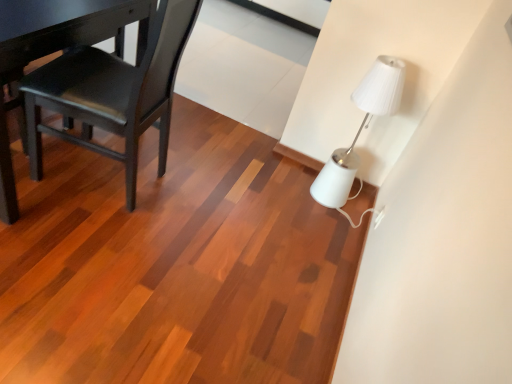
Measure the distance between white plastic electric outlet at lower right and camera.

white plastic electric outlet at lower right and camera are 6.59 feet apart.

The width and height of the screenshot is (512, 384). Describe the element at coordinates (113, 92) in the screenshot. I see `matte black chair at left` at that location.

In order to click on white plastic electric outlet at lower right in this screenshot , I will do `click(379, 216)`.

Considering the sizes of objects white glossy lamp at upper right and white plastic electric outlet at lower right in the image provided, who is wider, white glossy lamp at upper right or white plastic electric outlet at lower right?

white glossy lamp at upper right.

Does white glossy lamp at upper right appear on the left side of white plastic electric outlet at lower right?

Yes.

Who is taller, white glossy lamp at upper right or white plastic electric outlet at lower right?

Standing taller between the two is white glossy lamp at upper right.

What are the coordinates of `electric outlet below the white glossy lamp at upper right (from the image's perspective)` in the screenshot? It's located at (379, 216).

Consider the image. Which object is closer to the camera, white glossy lamp at upper right or matte black chair at left?

matte black chair at left is closer to the camera.

Can we say white glossy lamp at upper right lies outside matte black chair at left?

Yes.

Are white glossy lamp at upper right and matte black chair at left making contact?

No, white glossy lamp at upper right is not next to matte black chair at left.

How distant is white plastic electric outlet at lower right from matte black chair at left?

A distance of 1.30 meters exists between white plastic electric outlet at lower right and matte black chair at left.

Is point (381, 216) closer to viewer compared to point (68, 65)?

No, it is not.

Is white plastic electric outlet at lower right further to camera compared to matte black chair at left?

Yes, white plastic electric outlet at lower right is behind matte black chair at left.

Considering the relative positions of white plastic electric outlet at lower right and matte black chair at left in the image provided, is white plastic electric outlet at lower right to the right of matte black chair at left from the viewer's perspective?

Yes.

From a real-world perspective, is matte black chair at left above or below white glossy lamp at upper right?

Clearly, from a real-world perspective, matte black chair at left is above white glossy lamp at upper right.

Is point (87, 98) closer to viewer compared to point (334, 181)?

Yes, point (87, 98) is in front of point (334, 181).

Is matte black chair at left positioned with its back to white glossy lamp at upper right?

No, matte black chair at left's orientation is not away from white glossy lamp at upper right.

Can you see matte black chair at left touching white glossy lamp at upper right?

No, matte black chair at left is not touching white glossy lamp at upper right.

What are the coordinates of `chair in front of the white plastic electric outlet at lower right` in the screenshot? It's located at (113, 92).

Can you confirm if matte black chair at left is positioned to the left of white plastic electric outlet at lower right?

Yes, matte black chair at left is to the left of white plastic electric outlet at lower right.

Which of these two, matte black chair at left or white plastic electric outlet at lower right, is bigger?

matte black chair at left.

Which object is further away from the camera taking this photo, white plastic electric outlet at lower right or white glossy lamp at upper right?

white plastic electric outlet at lower right is further from the camera.

From the image's perspective, which one is positioned higher, white plastic electric outlet at lower right or white glossy lamp at upper right?

white glossy lamp at upper right is shown above in the image.

Between point (375, 222) and point (324, 174), which one is positioned behind?

The point (324, 174) is farther.

Can you tell me how much white plastic electric outlet at lower right and white glossy lamp at upper right differ in facing direction?

There is a 1.97-degree angle between the facing directions of white plastic electric outlet at lower right and white glossy lamp at upper right.

Image resolution: width=512 pixels, height=384 pixels. What are the coordinates of `electric outlet below the white glossy lamp at upper right (from the image's perspective)` in the screenshot? It's located at (379, 216).

Identify the location of lamp on the right of matte black chair at left. The image size is (512, 384). (360, 129).

Looking at the image, which one is located closer to white plastic electric outlet at lower right, white glossy lamp at upper right or matte black chair at left?

white glossy lamp at upper right is closer to white plastic electric outlet at lower right.

Considering their positions, is white glossy lamp at upper right positioned closer to matte black chair at left than white plastic electric outlet at lower right?

The object closer to matte black chair at left is white glossy lamp at upper right.

From the image, which object appears to be farther from white glossy lamp at upper right, matte black chair at left or white plastic electric outlet at lower right?

matte black chair at left.

Looking at the image, which one is located further to white glossy lamp at upper right, white plastic electric outlet at lower right or matte black chair at left?

matte black chair at left lies further to white glossy lamp at upper right than the other object.

When comparing their distances from matte black chair at left, does white plastic electric outlet at lower right or white glossy lamp at upper right seem further?

Among the two, white plastic electric outlet at lower right is located further to matte black chair at left.

Estimate the real-world distances between objects in this image. Which object is closer to white plastic electric outlet at lower right, matte black chair at left or white glossy lamp at upper right?

The object closer to white plastic electric outlet at lower right is white glossy lamp at upper right.

Find the location of a particular element. lamp between matte black chair at left and white plastic electric outlet at lower right in the horizontal direction is located at coordinates (360, 129).